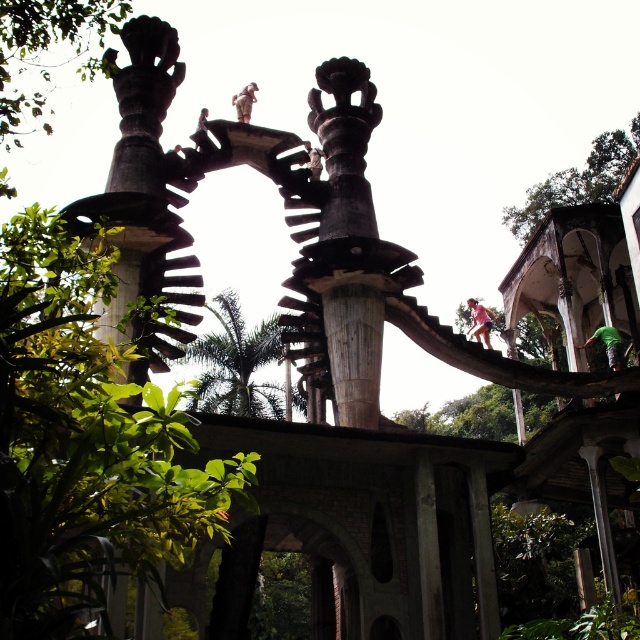
Question: Is green leafy tree at center bigger than polished bronze statue at upper center?

Choices:
 (A) yes
 (B) no

Answer: (A)

Question: Which of the following is the closest to the observer?

Choices:
 (A) (52, 326)
 (B) (52, 38)
 (C) (244, 92)
 (D) (612, 170)

Answer: (A)

Question: Among these points, which one is farthest from the camera?

Choices:
 (A) (252, 102)
 (B) (227, 301)

Answer: (B)

Question: Considering the real-world distances, which object is farthest from the green leafy tree at center?

Choices:
 (A) polished bronze statue at upper center
 (B) green leafy tree at left
 (C) green leafy tree at upper right

Answer: (C)

Question: Does green leafy tree at left appear under green leafy tree at upper left?

Choices:
 (A) no
 (B) yes

Answer: (B)

Question: Can you confirm if green leafy tree at center is positioned below polished bronze statue at upper center?

Choices:
 (A) yes
 (B) no

Answer: (A)